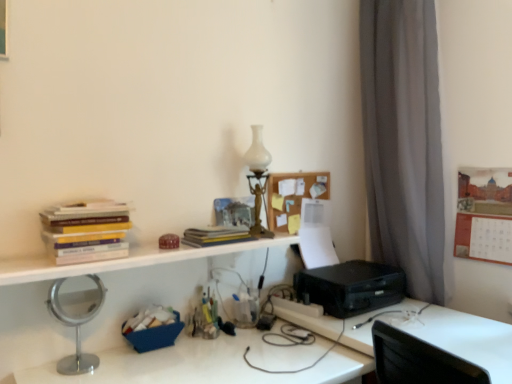
You are a GUI agent. You are given a task and a screenshot of the screen. Output one action in this format:
    pyautogui.click(x=<x>, y=<y>)
    Task: Click on the free spot to the right of blue fabric basket at lower left, which is counted as the first stationery, starting from the bottom
    
    Given the screenshot: What is the action you would take?
    pyautogui.click(x=202, y=352)